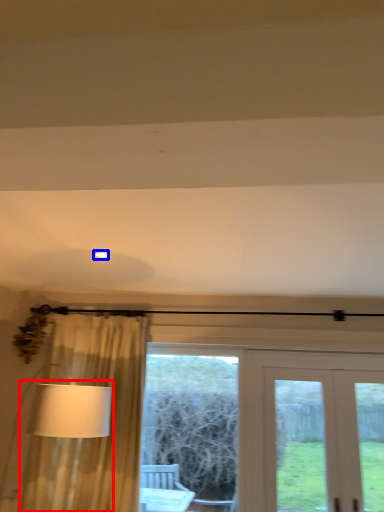
Question: Among these objects, which one is nearest to the camera, table lamp (highlighted by a red box) or lighting (highlighted by a blue box)?

Choices:
 (A) table lamp
 (B) lighting

Answer: (A)